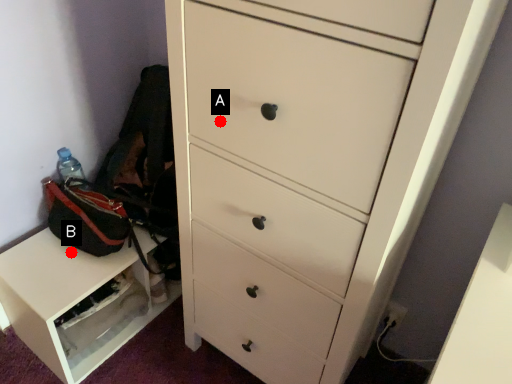
Question: Two points are circled on the image, labeled by A and B beside each circle. Which point appears closest to the camera in this image?

Choices:
 (A) A is closer
 (B) B is closer

Answer: (A)